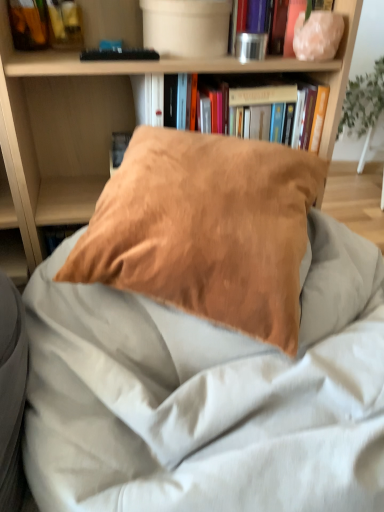
Question: Would you say green leafy plant at upper right is to the left or to the right of suede-like brown pillow at center in the picture?

Choices:
 (A) left
 (B) right

Answer: (B)

Question: Looking at the image, does green leafy plant at upper right seem bigger or smaller compared to suede-like brown pillow at center?

Choices:
 (A) big
 (B) small

Answer: (B)

Question: Which of these objects is positioned farthest from the metallic silver canister at upper center, arranged as the second book when ordered from the bottom?

Choices:
 (A) hardcover book at upper center, placed as the second book when sorted from top to bottom
 (B) suede-like brown pillow at center
 (C) matte brown pillow at center
 (D) green leafy plant at upper right
 (E) suede-like brown pillow at center

Answer: (D)

Question: Which is farther from the suede-like brown pillow at center?

Choices:
 (A) matte brown pillow at center
 (B) metallic silver canister at upper center, the first book when ordered from top to bottom
 (C) hardcover book at upper center, placed as the second book when sorted from top to bottom
 (D) green leafy plant at upper right
 (E) suede-like brown pillow at center

Answer: (D)